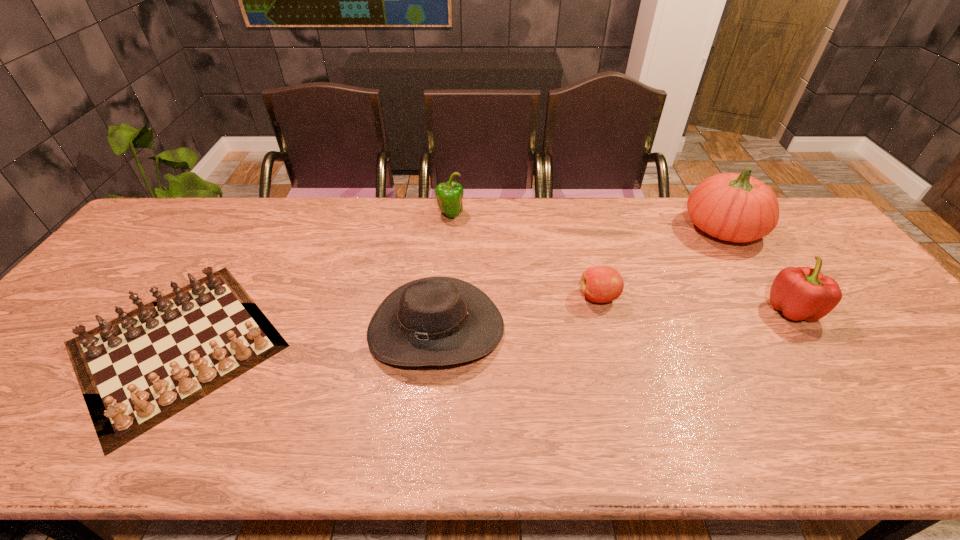
Find the location of a particular element. The height and width of the screenshot is (540, 960). empty space that is in between the nearer bell pepper and the fourth object from left to right is located at coordinates (695, 303).

Find the location of a particular element. This screenshot has width=960, height=540. free spot between the pumpkin and the apple is located at coordinates (660, 263).

I want to click on vacant space that's between the right bell pepper and the left bell pepper, so click(621, 262).

Identify which object is the third closest to the fourth object from left to right. Please provide its 2D coordinates. Your answer should be formatted as a tuple, i.e. [(x, y)], where the tuple contains the x and y coordinates of a point satisfying the conditions above.

[(802, 293)]

What are the coordinates of `object that is the third closest one to the pumpkin` in the screenshot? It's located at (435, 321).

Where is `vacant space that satisfies the following two spatial constraints: 1. on the front side of the right bell pepper; 2. on the left side of the apple`? vacant space that satisfies the following two spatial constraints: 1. on the front side of the right bell pepper; 2. on the left side of the apple is located at coordinates (602, 309).

Locate an element on the screen. This screenshot has height=540, width=960. vacant space that satisfies the following two spatial constraints: 1. on the front side of the apple; 2. on the right side of the nearer bell pepper is located at coordinates (602, 309).

The width and height of the screenshot is (960, 540). Identify the location of free space in the image that satisfies the following two spatial constraints: 1. on the front side of the nearer bell pepper; 2. on the left side of the tallest object. (775, 309).